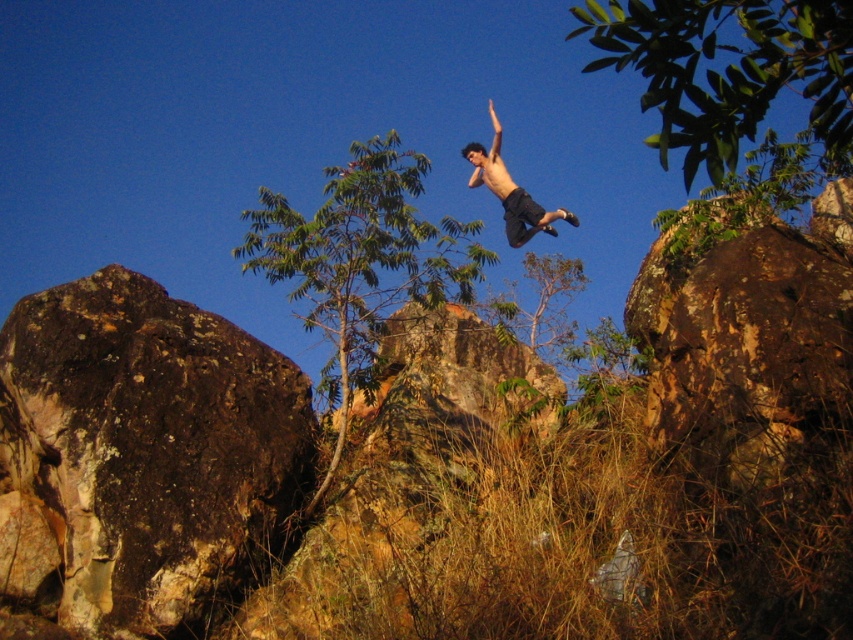
Is brown rough rock at left to the right of brown rough boulder at right from the viewer's perspective?

Incorrect, brown rough rock at left is not on the right side of brown rough boulder at right.

Can you confirm if brown rough rock at left is bigger than brown rough boulder at right?

Incorrect, brown rough rock at left is not larger than brown rough boulder at right.

At what (x,y) coordinates should I click in order to perform the action: click on brown rough rock at left. Please return your answer as a coordinate pair (x, y). This screenshot has height=640, width=853. Looking at the image, I should click on (141, 456).

I want to click on brown rough rock at left, so click(141, 456).

Which of these two, brown rough rock at left or green leafy tree at upper right, stands taller?

Standing taller between the two is green leafy tree at upper right.

This screenshot has height=640, width=853. What do you see at coordinates (141, 456) in the screenshot? I see `brown rough rock at left` at bounding box center [141, 456].

Is point (62, 356) positioned in front of point (695, 10)?

No, (62, 356) is further to viewer.

Identify the location of brown rough rock at left. The height and width of the screenshot is (640, 853). (141, 456).

Does green leafy tree at center lie in front of green leafy tree at upper right?

No, it is not.

Which is behind, point (425, 250) or point (670, 77)?

The point (425, 250) is behind.

Where is `green leafy tree at center`? The width and height of the screenshot is (853, 640). green leafy tree at center is located at coordinates (361, 262).